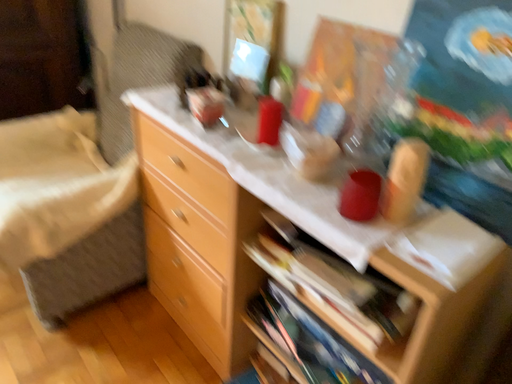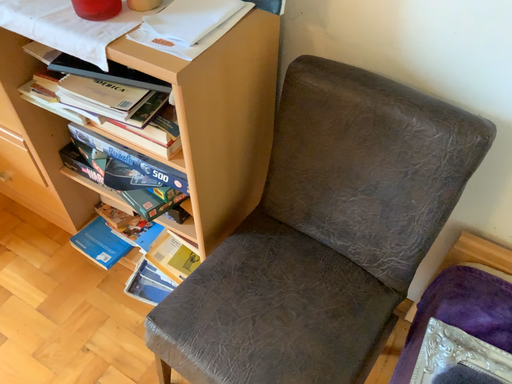
Question: How did the camera likely rotate when shooting the video?

Choices:
 (A) rotated right
 (B) rotated left

Answer: (A)